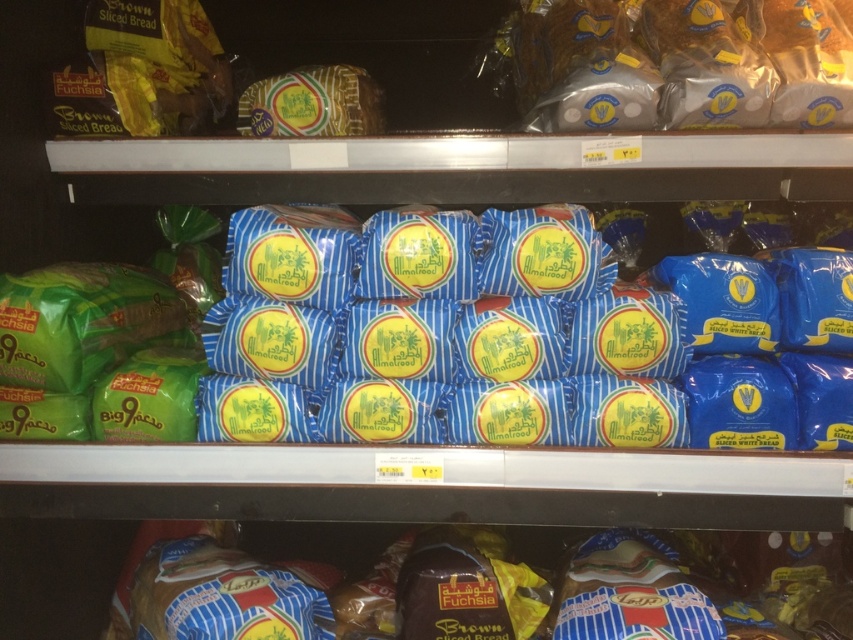
Which is in front, point (549, 38) or point (325, 584)?

Point (549, 38) is in front.

Identify the location of golden brown bread at upper right. Image resolution: width=853 pixels, height=640 pixels. (679, 64).